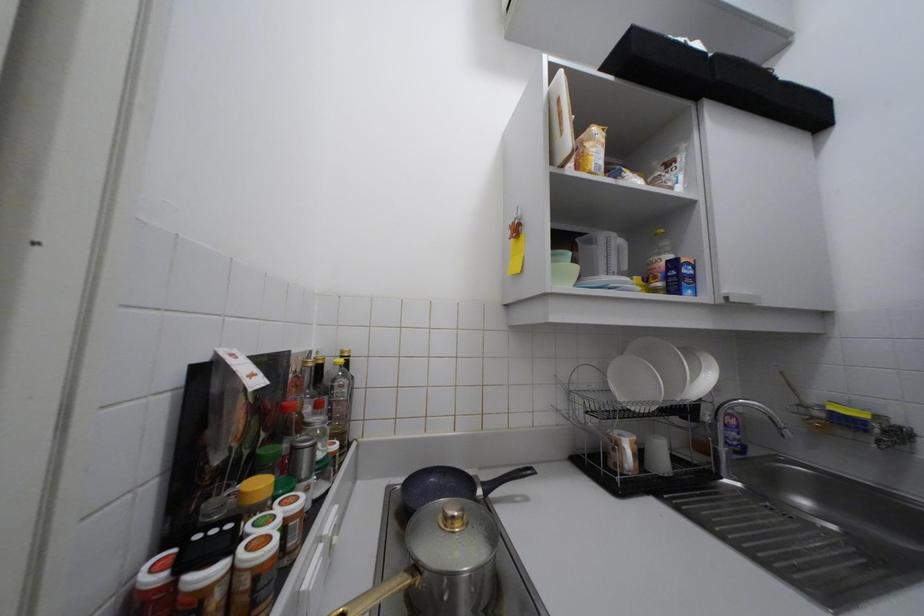
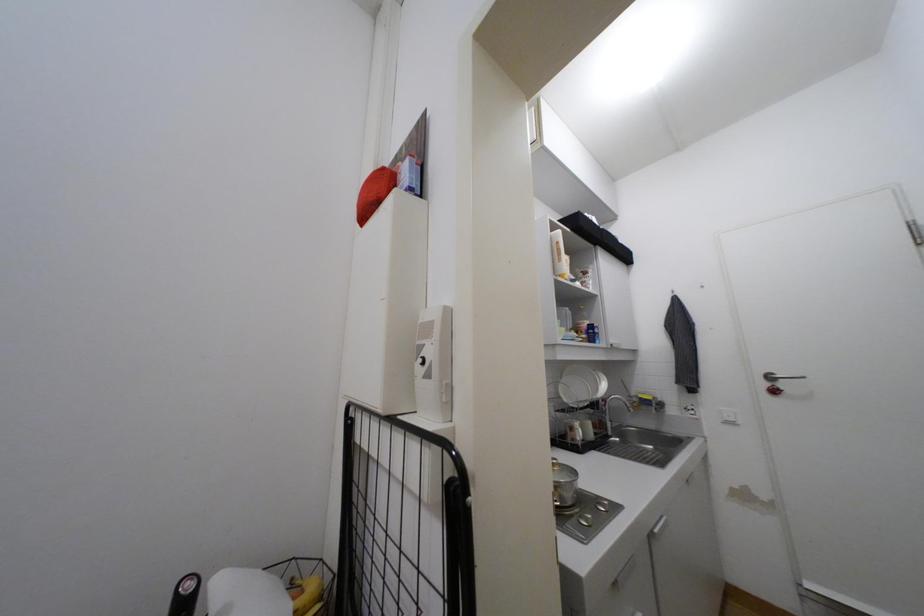
Question: The camera is either moving clockwise (left) or counter-clockwise (right) around the object. The first image is from the beginning of the video and the second image is from the end. Is the camera moving left or right when shooting the video?

Choices:
 (A) Left
 (B) Right

Answer: (A)